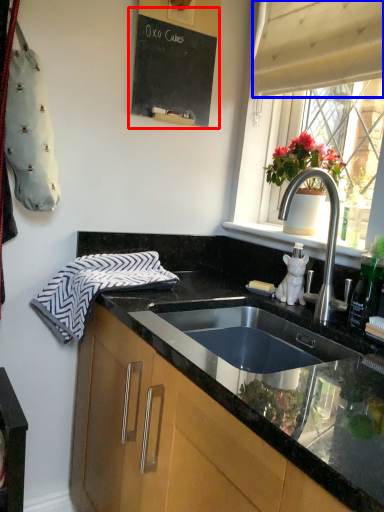
Question: Which object is closer to the camera taking this photo, bulletin board (highlighted by a red box) or curtain (highlighted by a blue box)?

Choices:
 (A) bulletin board
 (B) curtain

Answer: (B)